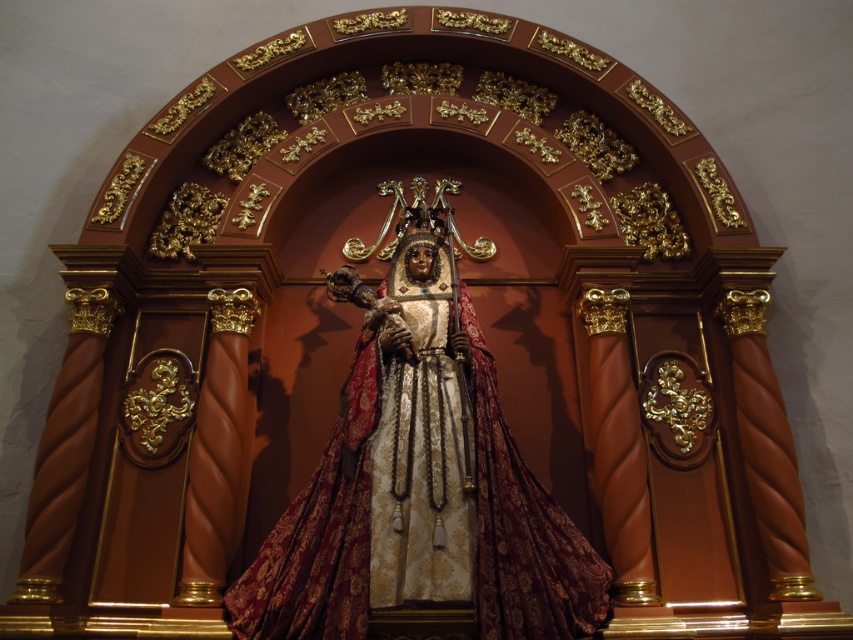
You are an art conservator examining the religious icon. You notice a specific point at coordinates (419, 472) on the image. Based on the description, what object does this point most likely belong to?

The point at coordinates (419, 472) corresponds to the gold plated statue at center.

You are an art conservator assessing the space between two statues on an altar. The gold plated statue at center and the gold textured statue at center are positioned side by side. Which statue has a greater width?

The gold plated statue at center is wider than the gold textured statue at center according to the description.